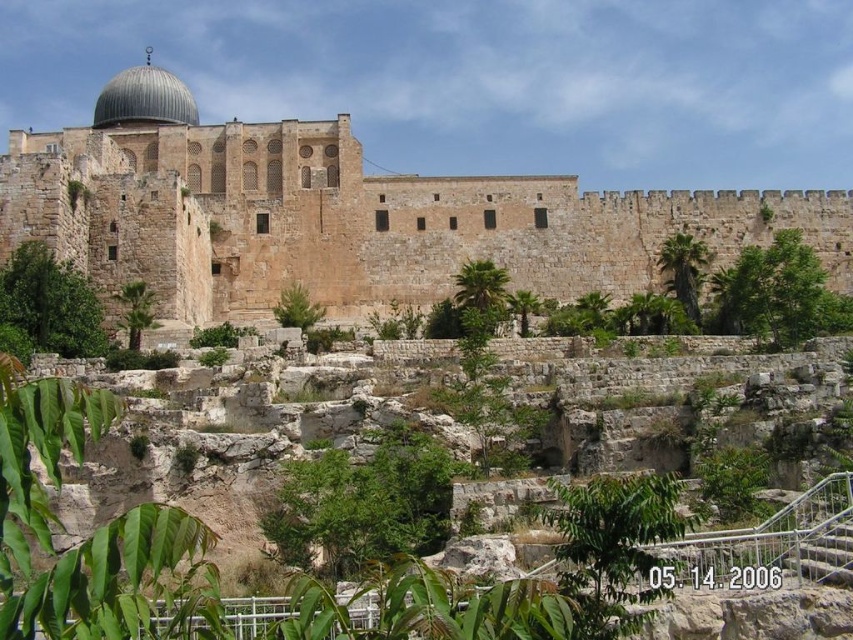
You are standing at the base of the historical stone structure and looking towards the dome. There is a point marked at coordinates [352,220]. What object is located at that point?

At point [352,220] lies brown stone castle at upper center.

You are an architect visiting the historical site and want to determine which structure is taller between the brown stone castle at upper center and the shiny silver dome at upper left. Based on the scene, which one is taller?

The shiny silver dome at upper left is taller than the brown stone castle at upper center.